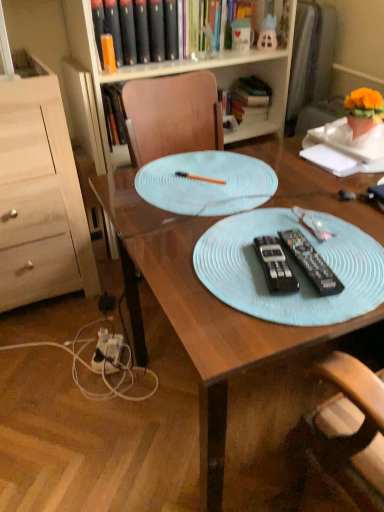
You are a GUI agent. You are given a task and a screenshot of the screen. Output one action in this format:
    pyautogui.click(x=<x>, y=<y>)
    Task: Click on the vacant space in front of white plastic power outlet at lower left
    The width and height of the screenshot is (384, 512).
    Given the screenshot: What is the action you would take?
    pyautogui.click(x=100, y=394)